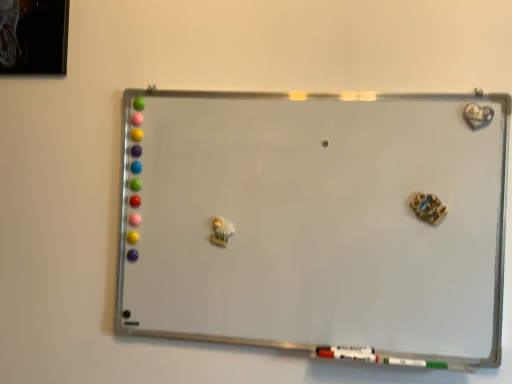
What do you see at coordinates (314, 222) in the screenshot? Image resolution: width=512 pixels, height=384 pixels. I see `white matte board at center` at bounding box center [314, 222].

The image size is (512, 384). Find the location of `white matte board at center`. white matte board at center is located at coordinates (314, 222).

The width and height of the screenshot is (512, 384). Find the location of `white matte board at center`. white matte board at center is located at coordinates (314, 222).